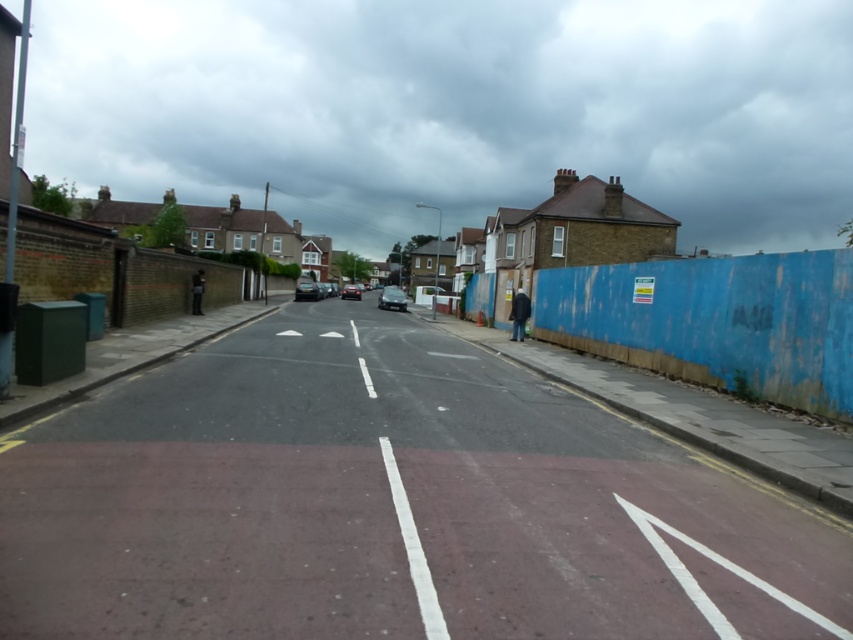
You are a delivery person needing to park your motorcycle between the metallic gray car at center and the matte black car at center. Given that your motorcycle is 1.8 meters wide, can you fit it between them?

The metallic gray car at center is larger than the matte black car at center, but the exact distance between them isn

You are a delivery driver needing to park your 15 feet long truck between the metallic gray car at center and the shiny black car at center. Can you fit your truck in the space between them?

The metallic gray car at center and shiny black car at center are 30.61 feet apart from each other. Since your truck is 15 feet long, there is enough space to park between them as 30.61 feet is greater than 15 feet.

You are a pedestrian standing at the red pedestrian crossing at the bottom of the frame. You want to cross the street to the blue construction fence on the right. Which car, the matte black car at center or the shiny black car at center, is closer to your starting position?

The matte black car at center is closer to your starting position because it is positioned to the left of the shiny black car at center, and since you are on the left side of the street near the pedestrian crossing, the car on the left would be nearer to you.